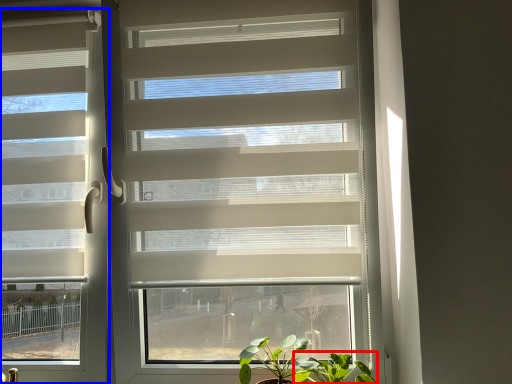
Question: Which point is further to the camera, vegetation (highlighted by a red box) or window blind (highlighted by a blue box)?

Choices:
 (A) vegetation
 (B) window blind

Answer: (B)